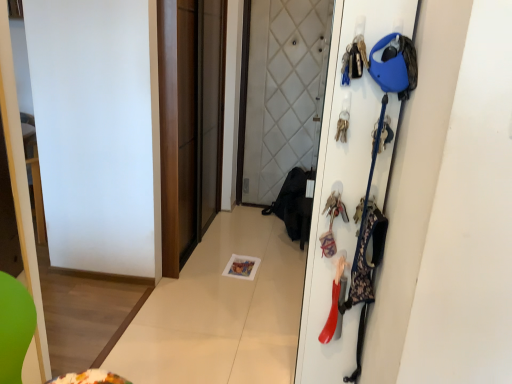
Question: Is white matte door at right completely or partially outside of metallic keychain at upper right, arranged as the 1th accessory when viewed from the top?

Choices:
 (A) no
 (B) yes

Answer: (B)

Question: Considering the relative sizes of white matte door at right and metallic keychain at upper right, arranged as the 1th accessory when viewed from the top, in the image provided, is white matte door at right shorter than metallic keychain at upper right, arranged as the 1th accessory when viewed from the top,?

Choices:
 (A) no
 (B) yes

Answer: (A)

Question: From the image's perspective, is white matte door at right above metallic keychain at upper right, marked as the 3th accessory in a bottom-to-top arrangement?

Choices:
 (A) yes
 (B) no

Answer: (B)

Question: Is white matte door at right bigger than metallic keychain at upper right, arranged as the 1th accessory when viewed from the top?

Choices:
 (A) no
 (B) yes

Answer: (B)

Question: Is white matte door at right facing away from metallic keychain at upper right, arranged as the 1th accessory when viewed from the top?

Choices:
 (A) yes
 (B) no

Answer: (B)

Question: Does white matte door at right appear on the left side of metallic keychain at upper right, marked as the 3th accessory in a bottom-to-top arrangement?

Choices:
 (A) yes
 (B) no

Answer: (B)

Question: Can you confirm if brown matte sliding door at center is wider than rubberized plastic shoe at right, the 1th accessory from the bottom?

Choices:
 (A) no
 (B) yes

Answer: (B)

Question: Could you tell me if brown matte sliding door at center is facing rubberized plastic shoe at right, the 1th accessory from the bottom?

Choices:
 (A) yes
 (B) no

Answer: (B)

Question: Would you say brown matte sliding door at center is a long distance from rubberized plastic shoe at right, the 3th accessory from the top?

Choices:
 (A) no
 (B) yes

Answer: (B)

Question: Can you confirm if brown matte sliding door at center is smaller than rubberized plastic shoe at right, the 3th accessory from the top?

Choices:
 (A) no
 (B) yes

Answer: (A)

Question: From a real-world perspective, does brown matte sliding door at center stand above rubberized plastic shoe at right, the 1th accessory from the bottom?

Choices:
 (A) no
 (B) yes

Answer: (B)

Question: Can we say brown matte sliding door at center lies outside rubberized plastic shoe at right, the 1th accessory from the bottom?

Choices:
 (A) no
 (B) yes

Answer: (B)

Question: Is the depth of floral fabric bag at right, which is the 2th accessory from top to bottom, greater than that of white matte door at right?

Choices:
 (A) yes
 (B) no

Answer: (A)